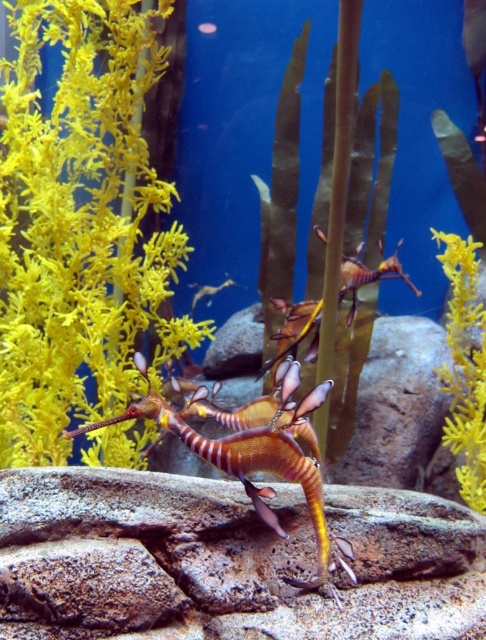
Who is taller, shiny metallic fish at center or translucent yellow fish at center?

translucent yellow fish at center

Who is shorter, shiny metallic fish at center or translucent yellow fish at center?

shiny metallic fish at center

This screenshot has width=486, height=640. Find the location of `shiny metallic fish at center`. shiny metallic fish at center is located at coordinates (262, 504).

Is smooth gray rock at center below translucent yellow fish at center?

Yes, smooth gray rock at center is below translucent yellow fish at center.

Based on the photo, is smooth gray rock at center taller than translucent yellow fish at center?

Indeed, smooth gray rock at center has a greater height compared to translucent yellow fish at center.

Which is in front, point (179, 612) or point (197, 285)?

Positioned in front is point (179, 612).

Locate an element on the screen. This screenshot has height=640, width=486. smooth gray rock at center is located at coordinates (228, 557).

Is yellow matte plant at left bigger than shiny metallic fish at center?

Indeed, yellow matte plant at left has a larger size compared to shiny metallic fish at center.

Can you confirm if yellow matte plant at left is positioned above shiny metallic fish at center?

Correct, yellow matte plant at left is located above shiny metallic fish at center.

Which is behind, point (133, 237) or point (246, 483)?

Point (133, 237)

At what (x,y) coordinates should I click in order to perform the action: click on yellow matte plant at left. Please return your answer as a coordinate pair (x, y). Looking at the image, I should click on (80, 225).